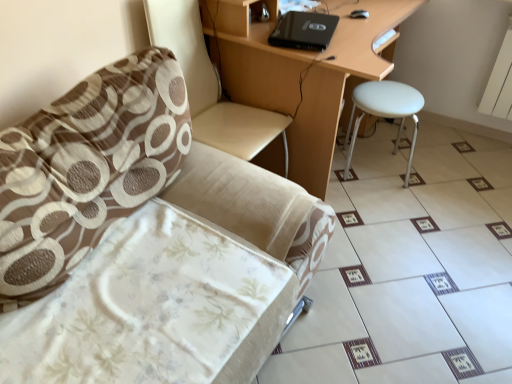
At what (x,y) coordinates should I click in order to perform the action: click on vacant space in front of white matte stool at right. Please return your answer as a coordinate pair (x, y). Looking at the image, I should click on (394, 213).